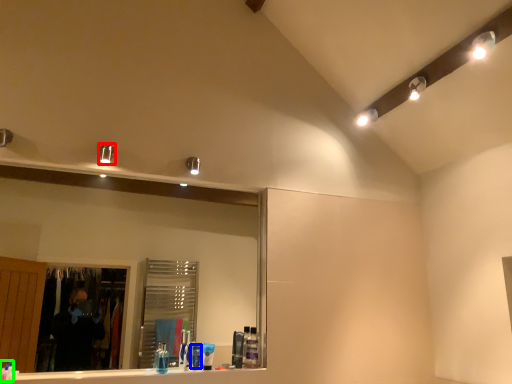
Question: Which object is positioned farthest from light fixture (highlighted by a red box)? Select from toiletry (highlighted by a blue box) and toothpaste (highlighted by a green box).

Choices:
 (A) toiletry
 (B) toothpaste

Answer: (B)